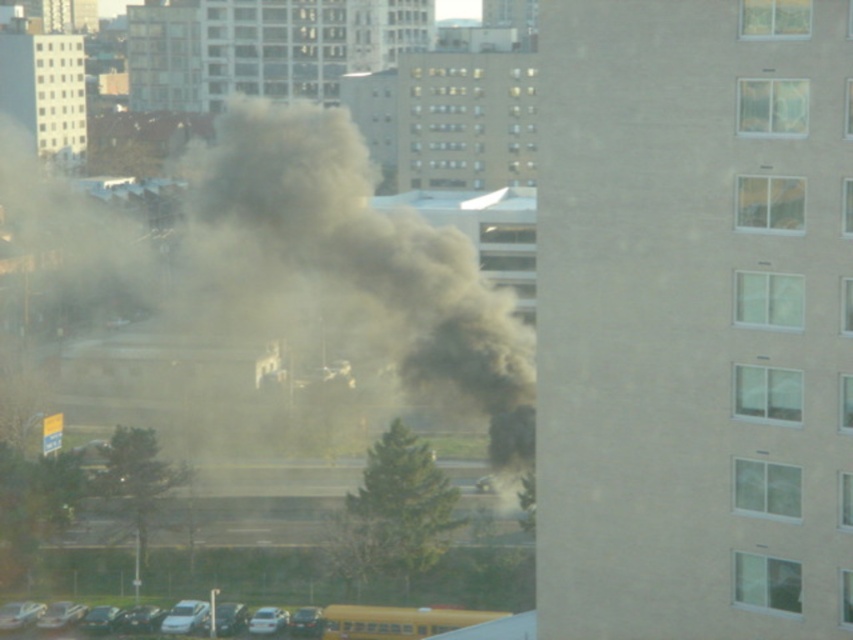
Which of these two, gray/dense smoke at center or yellow matte school bus at lower center, stands shorter?

yellow matte school bus at lower center is shorter.

What do you see at coordinates (346, 266) in the screenshot? This screenshot has width=853, height=640. I see `gray/dense smoke at center` at bounding box center [346, 266].

Locate an element on the screen. Image resolution: width=853 pixels, height=640 pixels. gray/dense smoke at center is located at coordinates (346, 266).

This screenshot has height=640, width=853. What are the coordinates of `gray/dense smoke at center` in the screenshot? It's located at (346, 266).